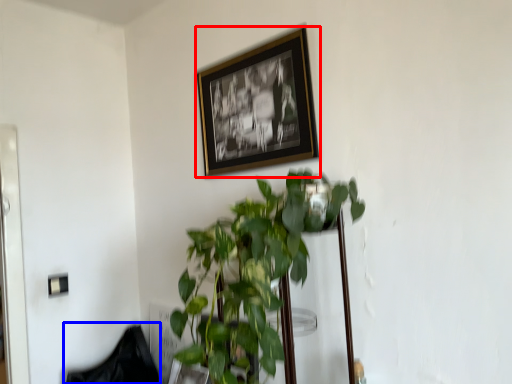
Question: Which object appears closest to the camera in this image, picture frame (highlighted by a red box) or swivel chair (highlighted by a blue box)?

Choices:
 (A) picture frame
 (B) swivel chair

Answer: (A)